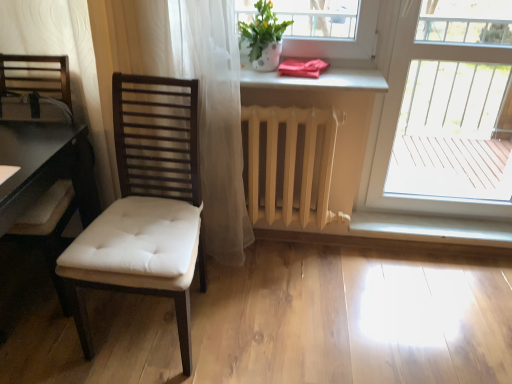
Image resolution: width=512 pixels, height=384 pixels. Identify the location of vacant region below transparent glass door at right (from a real-world perspective). (440, 223).